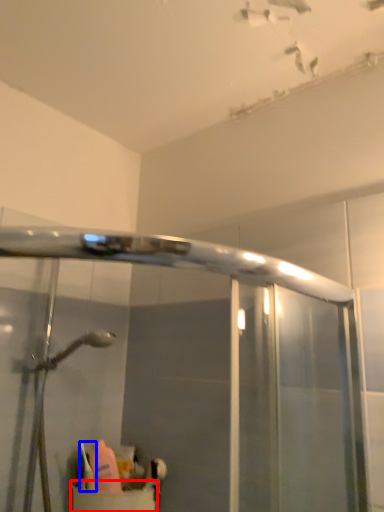
Question: Which point is closer to the camera, sink (highlighted by a red box) or toiletry (highlighted by a blue box)?

Choices:
 (A) sink
 (B) toiletry

Answer: (A)